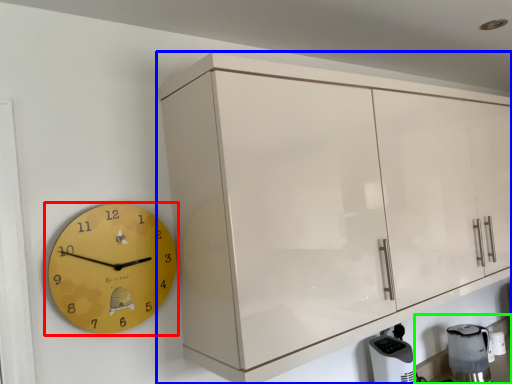
Question: Based on their relative distances, which object is nearer to wall clock (highlighted by a red box)? Choose from cabinetry (highlighted by a blue box) and counter top (highlighted by a green box).

Choices:
 (A) cabinetry
 (B) counter top

Answer: (A)